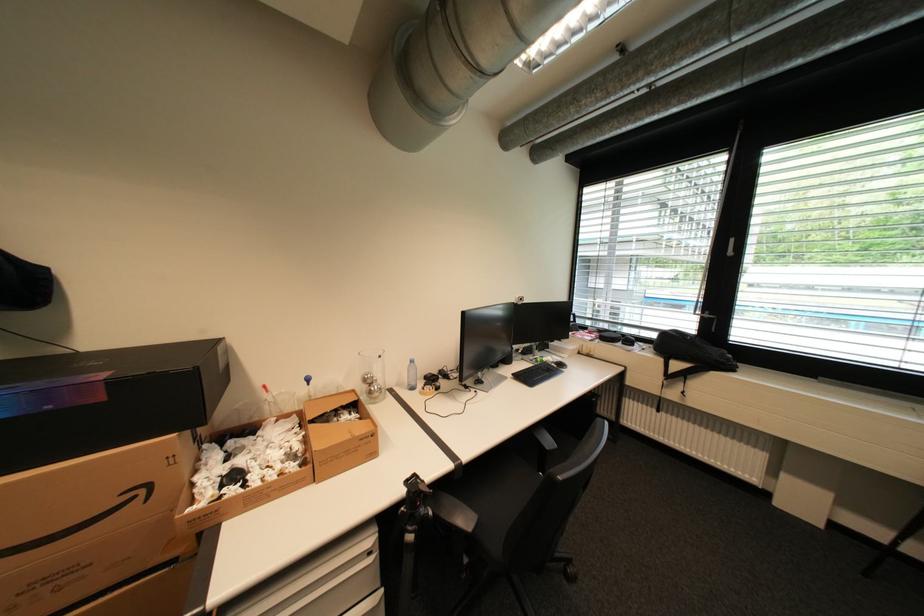
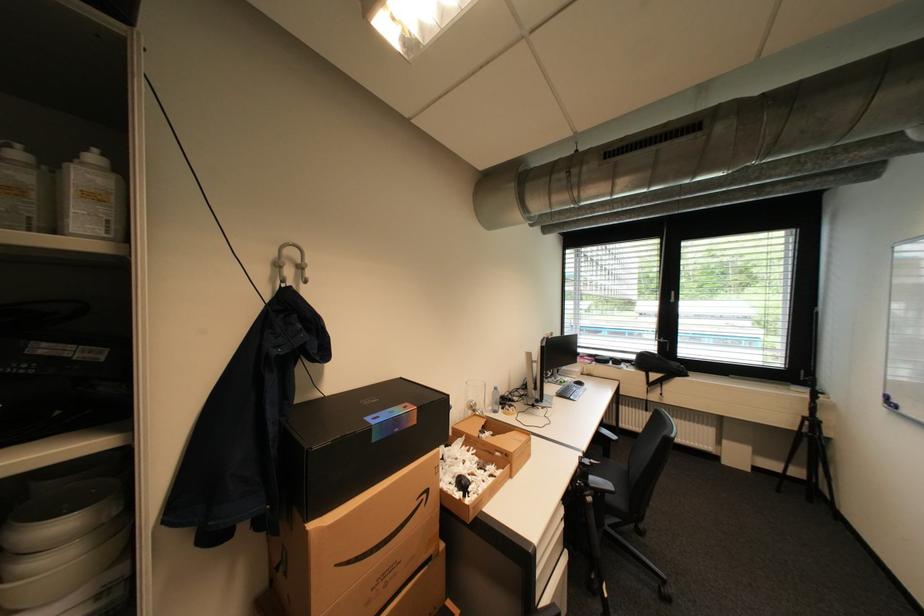
In the second image, find the point that corresponds to the point at 58,407 in the first image.

(405, 431)